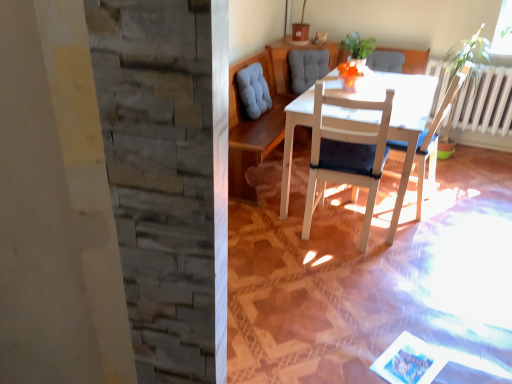
Question: Which direction should I rotate to look at white wood chair at center, acting as the second chair starting from the left, — up or down?

Choices:
 (A) down
 (B) up

Answer: (B)

Question: Can you confirm if green leafy plant at upper center is bigger than white wood chair at center, acting as the second chair starting from the left?

Choices:
 (A) yes
 (B) no

Answer: (B)

Question: From a real-world perspective, is green leafy plant at upper center positioned under white wood chair at center, acting as the second chair starting from the left, based on gravity?

Choices:
 (A) no
 (B) yes

Answer: (A)

Question: Is green leafy plant at upper center far from white wood chair at center, which appears as the 1th chair when viewed from the right?

Choices:
 (A) no
 (B) yes

Answer: (B)

Question: Is green leafy plant at upper center positioned behind white wood chair at center, which appears as the 1th chair when viewed from the right?

Choices:
 (A) yes
 (B) no

Answer: (A)

Question: Is green leafy plant at upper center not inside white wood chair at center, acting as the second chair starting from the left?

Choices:
 (A) no
 (B) yes

Answer: (B)

Question: From the image's perspective, is green leafy plant at upper center on white wood chair at center, acting as the second chair starting from the left?

Choices:
 (A) yes
 (B) no

Answer: (A)

Question: Is white wood chair at center, placed as the second chair when sorted from right to left, not close to white wood chair at center, acting as the second chair starting from the left?

Choices:
 (A) no
 (B) yes

Answer: (A)

Question: Does white wood chair at center, placed as the second chair when sorted from right to left, have a lesser height compared to white wood chair at center, acting as the second chair starting from the left?

Choices:
 (A) no
 (B) yes

Answer: (A)

Question: Considering the relative sizes of white wood chair at center, placed as the second chair when sorted from right to left, and white wood chair at center, acting as the second chair starting from the left, in the image provided, is white wood chair at center, placed as the second chair when sorted from right to left, smaller than white wood chair at center, acting as the second chair starting from the left,?

Choices:
 (A) no
 (B) yes

Answer: (A)

Question: Does white wood chair at center, placed as the second chair when sorted from right to left, have a greater height compared to white wood chair at center, acting as the second chair starting from the left?

Choices:
 (A) yes
 (B) no

Answer: (A)

Question: Does white wood chair at center, placed as the second chair when sorted from right to left, have a greater width compared to white wood chair at center, acting as the second chair starting from the left?

Choices:
 (A) no
 (B) yes

Answer: (B)

Question: Is the depth of white wood chair at center, placed as the second chair when sorted from right to left, greater than that of white wood chair at center, acting as the second chair starting from the left?

Choices:
 (A) no
 (B) yes

Answer: (A)

Question: Does white wood chair at center, which appears as the 1th chair when viewed from the right, lie behind white wood table at center?

Choices:
 (A) no
 (B) yes

Answer: (B)